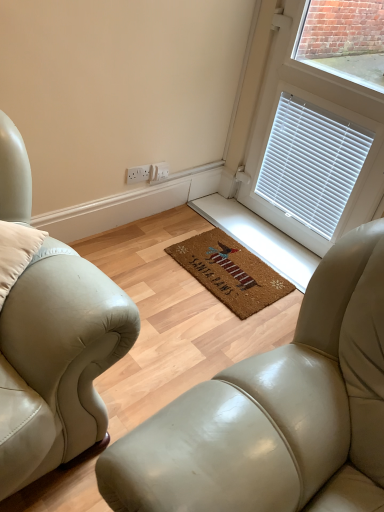
Where is `vacant area that lies in front of brown coir mat at center`? This screenshot has height=512, width=384. vacant area that lies in front of brown coir mat at center is located at coordinates (214, 323).